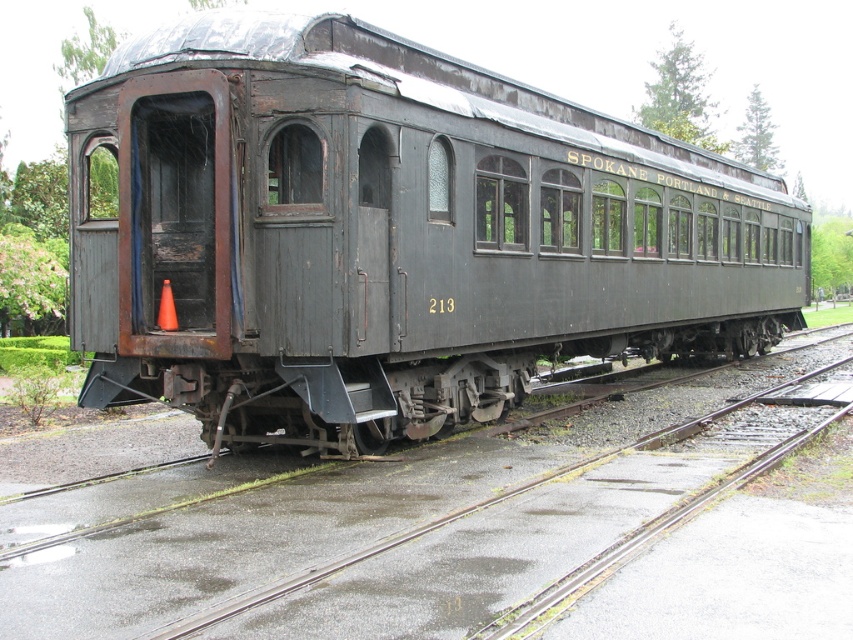
Does point (477, 195) come in front of point (126, 516)?

No, it is not.

Who is more forward, [378,371] or [799,529]?

Point [799,529] is more forward.

Who is more distant from viewer, (374,196) or (625,433)?

Positioned behind is point (625,433).

You are a GUI agent. You are given a task and a screenshot of the screen. Output one action in this format:
    pyautogui.click(x=<x>, y=<y>)
    Task: Click on the rusty metal train car at center
    This screenshot has height=640, width=853.
    Given the screenshot: What is the action you would take?
    (389, 234)